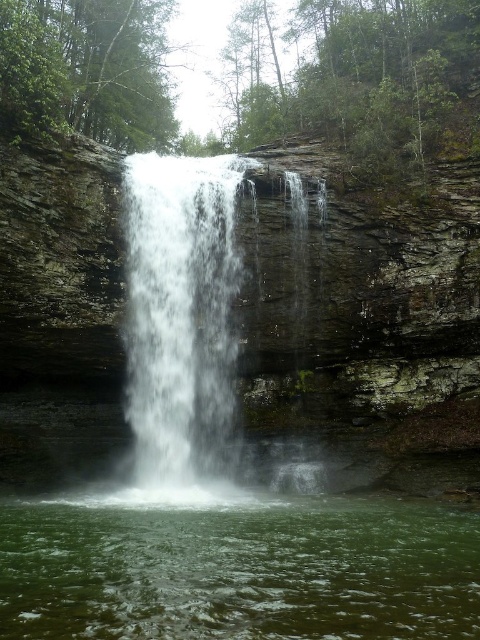
You are standing in front of the waterfall and want to take a photo. Which of the two elements, the green liquid at center or the white frothy water at center, will appear larger in your camera viewfinder?

The green liquid at center will appear larger in your camera viewfinder because it is closer to the viewer than the white frothy water at center.

You are a hiker who wants to collect some water from the waterfall. You notice two areas of water at the center of the scene. Which one would you choose to collect water from, the green liquid at center or the white frothy water at center, and why?

You should collect water from the green liquid at center because it has a smaller size compared to the white frothy water at center, suggesting it might be calmer and safer to approach.